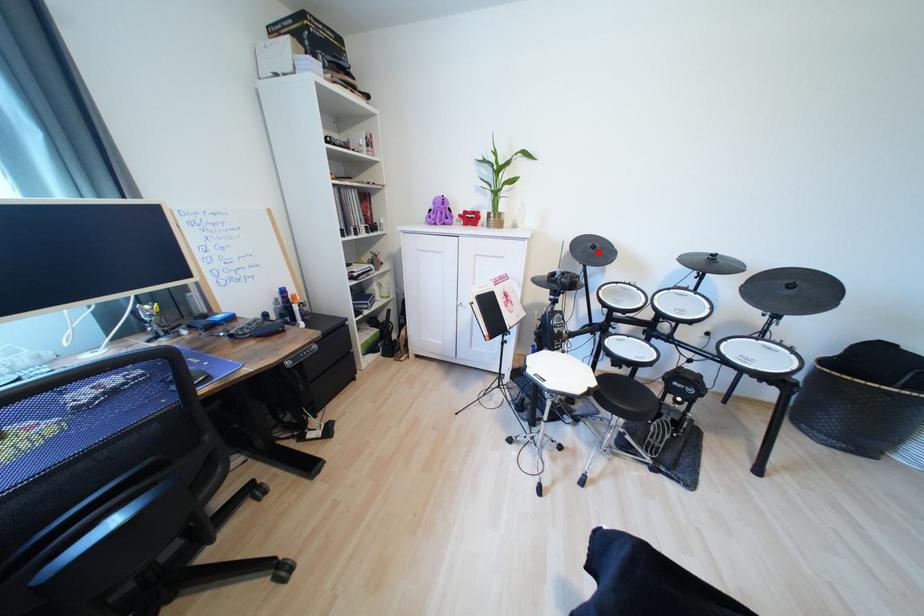
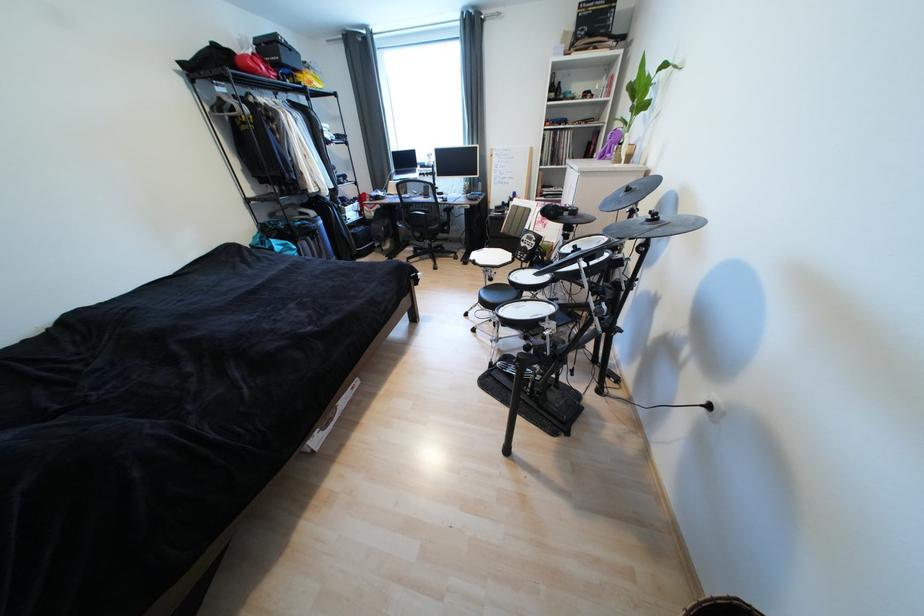
In the second image, find the point that corresponds to the highlighted location in the first image.

(628, 196)